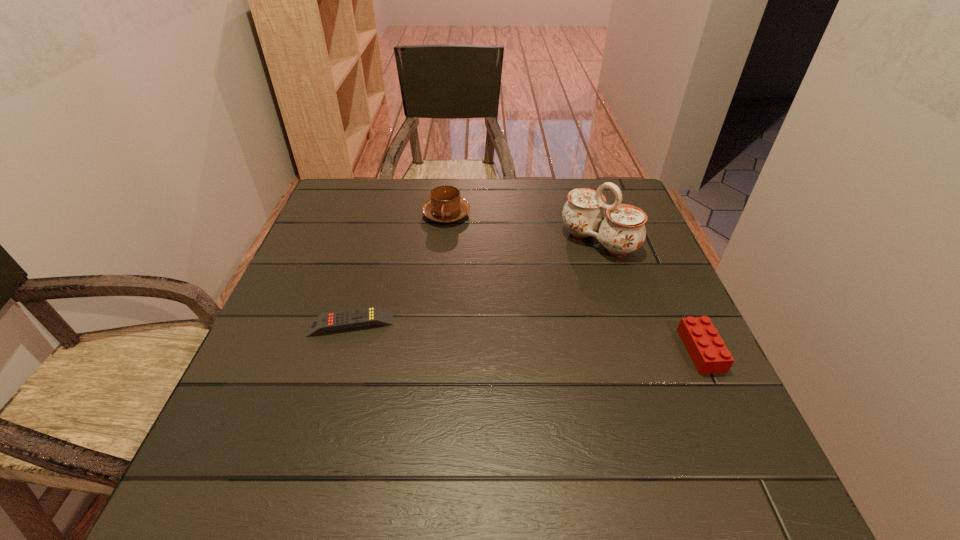
This screenshot has width=960, height=540. What are the coordinates of `empty location between the leftmost object and the cappuccino` in the screenshot? It's located at (398, 269).

Where is `free point between the second tallest object and the third object from left to right`? This screenshot has width=960, height=540. free point between the second tallest object and the third object from left to right is located at coordinates (522, 228).

Where is `vacant space in between the rightmost object and the second object from left to right`? This screenshot has width=960, height=540. vacant space in between the rightmost object and the second object from left to right is located at coordinates (573, 282).

The image size is (960, 540). In order to click on empty space between the Lego and the leftmost object in this screenshot , I will do `click(526, 337)`.

You are a GUI agent. You are given a task and a screenshot of the screen. Output one action in this format:
    pyautogui.click(x=<x>, y=<y>)
    Task: Click on the empty location between the second object from left to right and the chinaware
    The width and height of the screenshot is (960, 540).
    Given the screenshot: What is the action you would take?
    pyautogui.click(x=522, y=228)

Locate an element on the screen. The height and width of the screenshot is (540, 960). vacant area that lies between the cappuccino and the leftmost object is located at coordinates (398, 269).

At what (x,y) coordinates should I click in order to perform the action: click on empty space between the third shortest object and the Lego. Please return your answer as a coordinate pair (x, y). Looking at the image, I should click on (573, 282).

In order to click on free spot between the rightmost object and the shortest object in this screenshot , I will do `click(526, 337)`.

I want to click on vacant area that lies between the tallest object and the second tallest object, so click(x=522, y=228).

Select which object is the closest to the remote control. Please provide its 2D coordinates. Your answer should be formatted as a tuple, i.e. [(x, y)], where the tuple contains the x and y coordinates of a point satisfying the conditions above.

[(445, 206)]